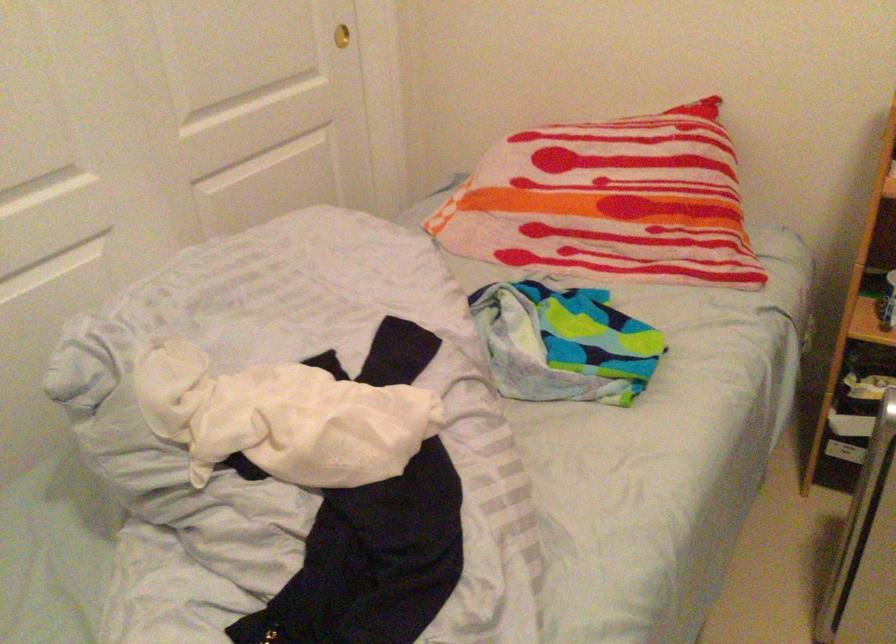
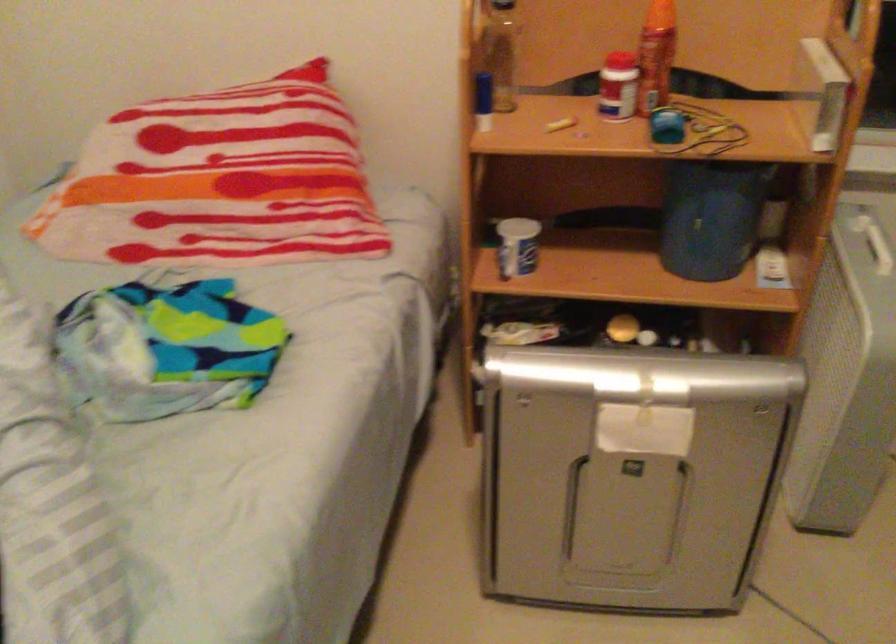
Question: Based on the continuous images, in which direction is the camera rotating? Reply with the corresponding letter.

Choices:
 (A) Left
 (B) Right
 (C) Up
 (D) Down

Answer: (B)